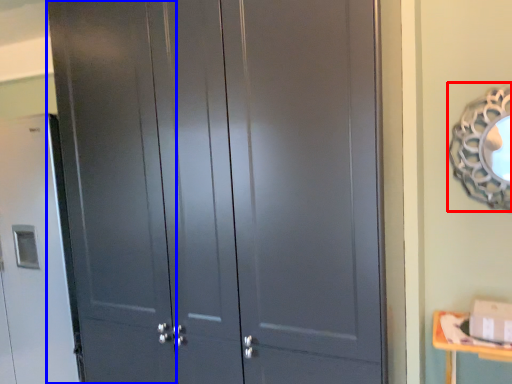
Question: Among these objects, which one is farthest to the camera, mirror (highlighted by a red box) or screen door (highlighted by a blue box)?

Choices:
 (A) mirror
 (B) screen door

Answer: (B)